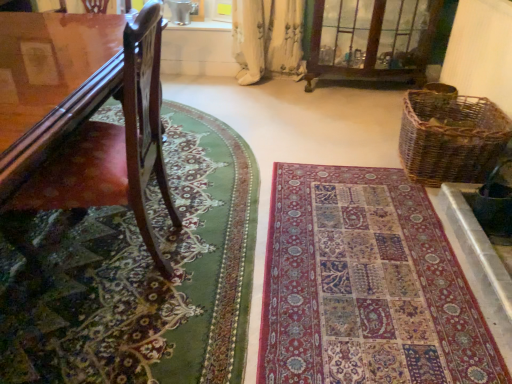
This screenshot has height=384, width=512. In order to click on vacant area situated to the left side of clear glass cabinet at upper center in this screenshot , I will do `click(283, 95)`.